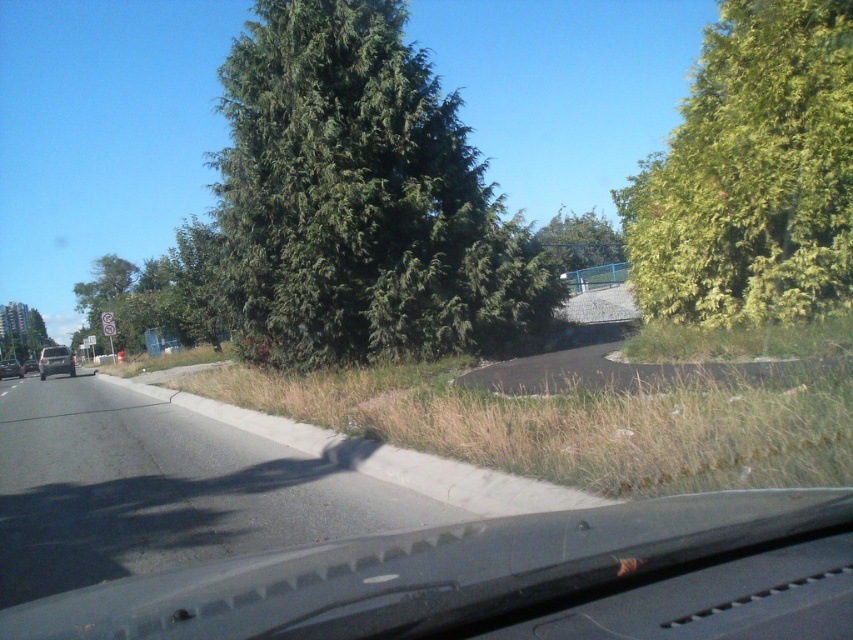
You are a passenger in a car and looking out the window. You see the black rubber windshield at lower center and the green leafy tree at left. Which object is closer to you?

The black rubber windshield at lower center is closer to you because it is positioned below the green leafy tree at left, indicating it is in front of the tree from your viewpoint.

You are a delivery driver who needs to park your vehicle on the curb. The curb has a No Parking sign at the left side of the road. There is a point at coordinates point (769, 580) that is 9.72 feet away from you. Can you safely park your vehicle here without violating the parking rules?

The point at coordinates point (769, 580) is 9.72 feet away from the viewer. Since the No Parking sign is on the left side of the road, you must ensure that parking at this point does not violate the restrictions indicated by the sign. However, the distance provided does not directly indicate whether the parking spot is within the prohibited area. Check the sign for specific restrictions like distance limits or time limits before deciding to park.

You are a driver looking out the windshield and see the green leafy tree at left and the green leafy tree at upper center. Which tree is taller?

The green leafy tree at left is taller than the green leafy tree at upper center.